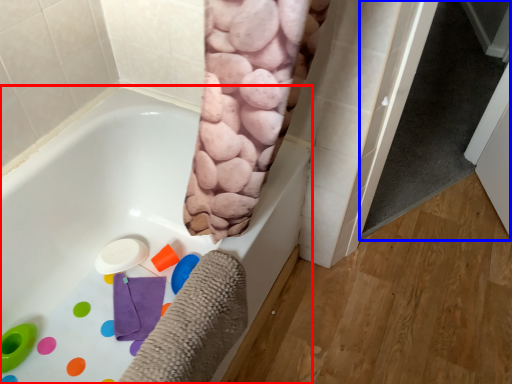
Question: Which object appears closest to the camera in this image, bathtub (highlighted by a red box) or screen door (highlighted by a blue box)?

Choices:
 (A) bathtub
 (B) screen door

Answer: (A)